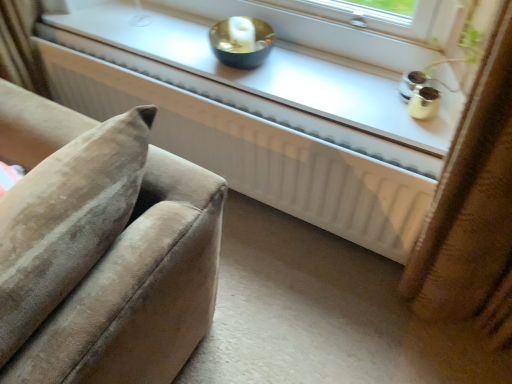
Question: Considering the relative positions of white glossy window sill at upper center and white matte radiator at center in the image provided, is white glossy window sill at upper center to the left or to the right of white matte radiator at center?

Choices:
 (A) left
 (B) right

Answer: (B)

Question: Relative to white matte radiator at center, is white glossy window sill at upper center in front or behind?

Choices:
 (A) front
 (B) behind

Answer: (B)

Question: From a real-world perspective, relative to white matte radiator at center, is white glossy window sill at upper center vertically above or below?

Choices:
 (A) above
 (B) below

Answer: (A)

Question: Would you say white matte radiator at center is to the left or to the right of white glossy window sill at upper center in the picture?

Choices:
 (A) right
 (B) left

Answer: (B)

Question: Considering the positions of white matte radiator at center and white glossy window sill at upper center in the image, is white matte radiator at center taller or shorter than white glossy window sill at upper center?

Choices:
 (A) tall
 (B) short

Answer: (A)

Question: In terms of width, does white matte radiator at center look wider or thinner when compared to white glossy window sill at upper center?

Choices:
 (A) thin
 (B) wide

Answer: (A)

Question: Is white matte radiator at center situated inside white glossy window sill at upper center or outside?

Choices:
 (A) inside
 (B) outside

Answer: (B)